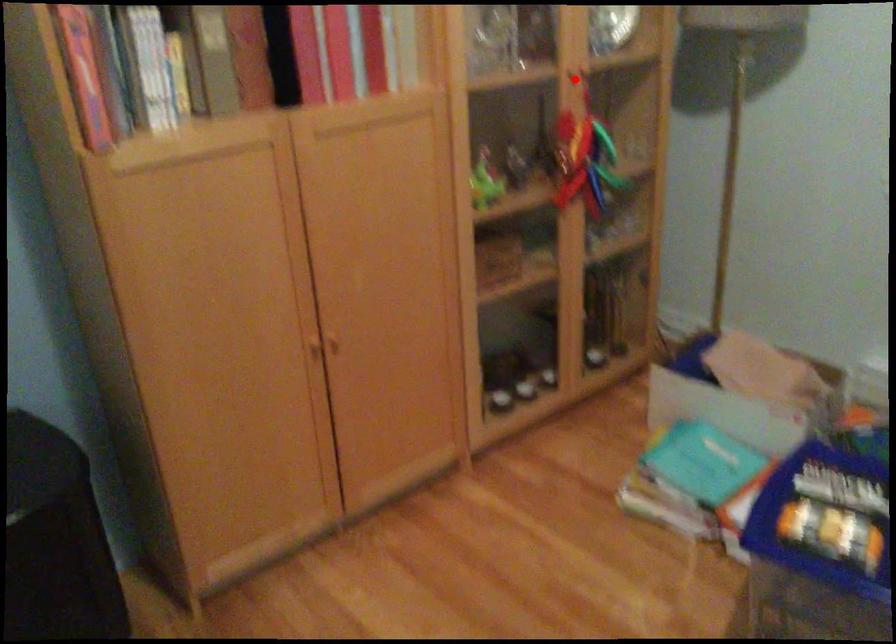
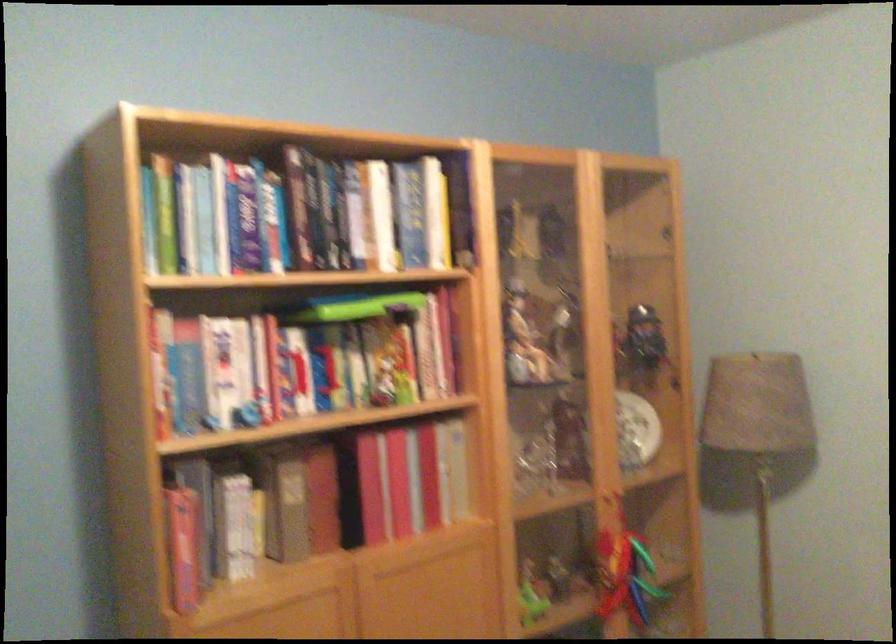
Locate, in the second image, the point that corresponds to the highlighted location in the first image.

(615, 497)